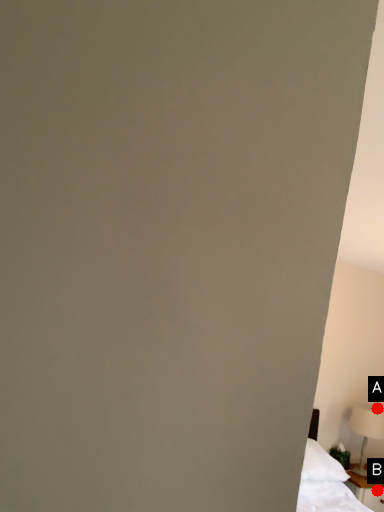
Question: Two points are circled on the image, labeled by A and B beside each circle. Which point appears closest to the camera in this image?

Choices:
 (A) A is closer
 (B) B is closer

Answer: (B)